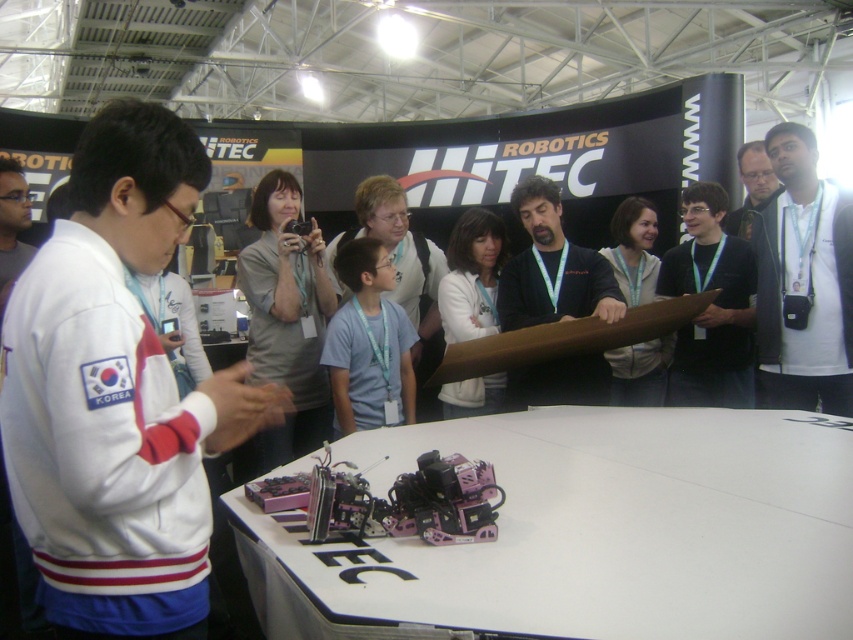
You are a participant at the robotics event and need to locate the black fabric at center and the matte black shirt at upper right. From your perspective standing in front of the table, which object is closer to you?

The black fabric at center is closer to you since it is in front of the matte black shirt at upper right.

You are organizing a photo shoot for a fashion magazine and need to arrange two jackets on a table. The white fleece jacket at left and the white matte jacket at center are available. If you want to place them side by side without overlapping, which jacket should be placed on the left side to ensure there is enough space?

The white fleece jacket at left should be placed on the left side because it is wider than the white matte jacket at center, allowing sufficient space between them without overlapping.

You are a participant at the robotics event and need to choose a jacket to wear over your competition attire. The jackets available are the white fleece jacket at left and the white matte jacket at center. Which jacket would you pick if you want one that is bigger in size?

The white fleece jacket at left is larger in size compared to the white matte jacket at center, so you should choose the white fleece jacket at left.